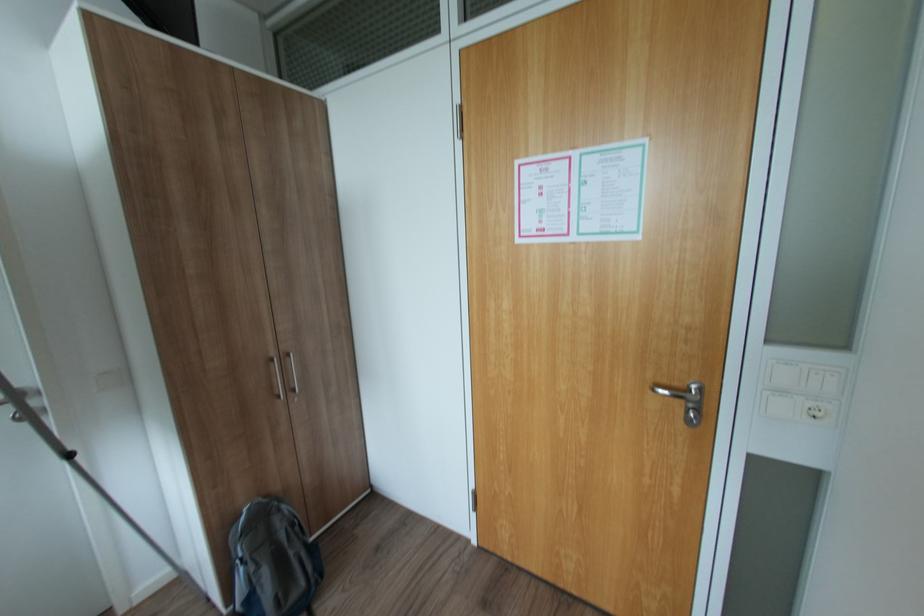
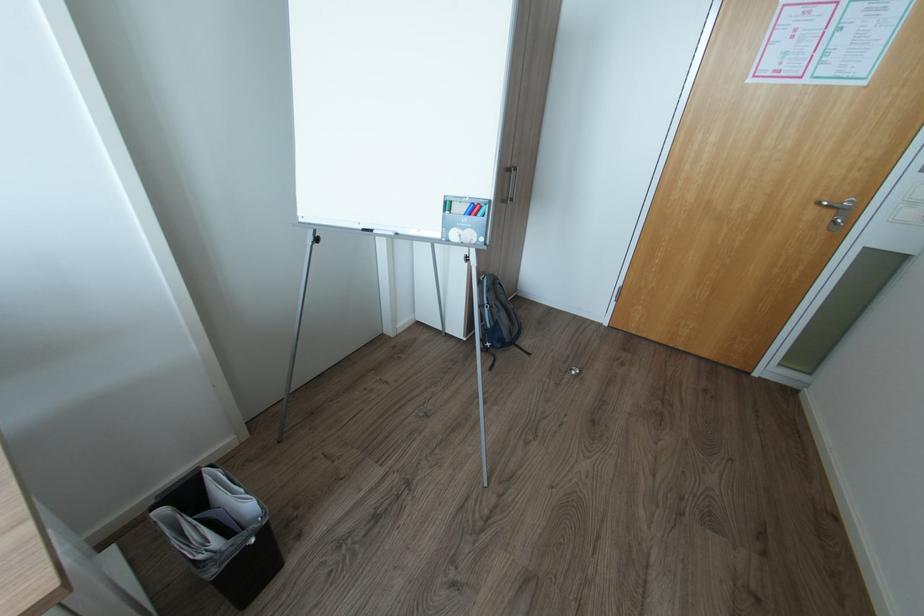
Find the pixel in the second image that matches the point at 664,390 in the first image.

(830, 204)